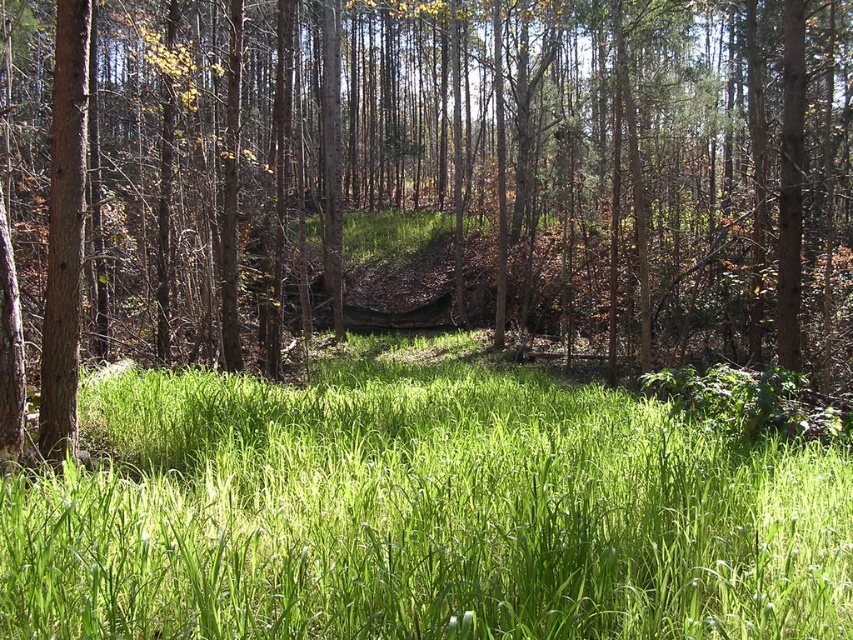
You are standing in the forest and see the brown wood tree at center and the green grassy at center. Which object is located to the right of the other?

The brown wood tree at center is positioned on the right side of green grassy at center.

You are a hiker who wants to take a photo of the brown wood tree at center and the green grassy at center. Which object should you focus on first if you want both to be in sharp focus?

The brown wood tree at center is bigger than the green grassy at center, so you should focus on the brown wood tree at center first to ensure both are in sharp focus.